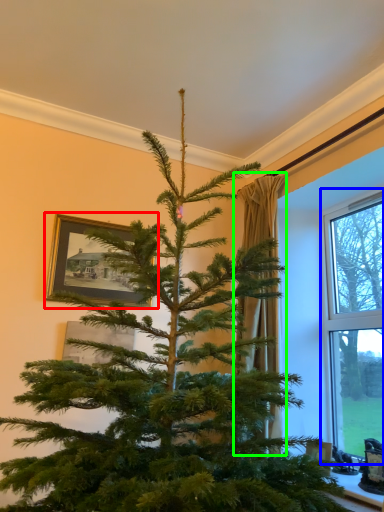
Question: Based on their relative distances, which object is nearer to picture frame (highlighted by a red box)? Choose from window (highlighted by a blue box) and curtain (highlighted by a green box).

Choices:
 (A) window
 (B) curtain

Answer: (B)